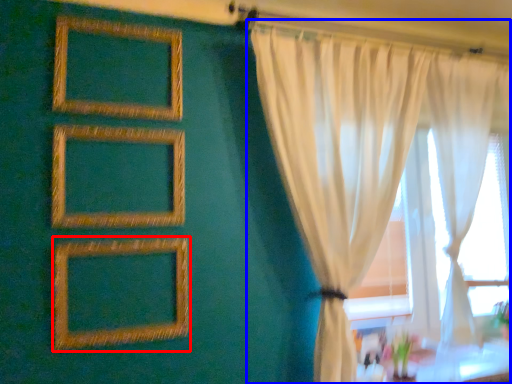
Question: Which point is closer to the camera, picture frame (highlighted by a red box) or curtain (highlighted by a blue box)?

Choices:
 (A) picture frame
 (B) curtain

Answer: (A)